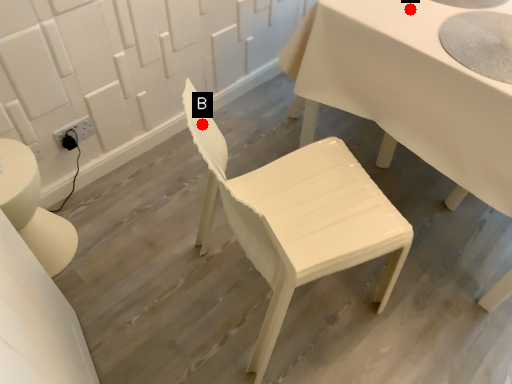
Question: Two points are circled on the image, labeled by A and B beside each circle. Which of the following is the farthest from the observer?

Choices:
 (A) A is further
 (B) B is further

Answer: (A)